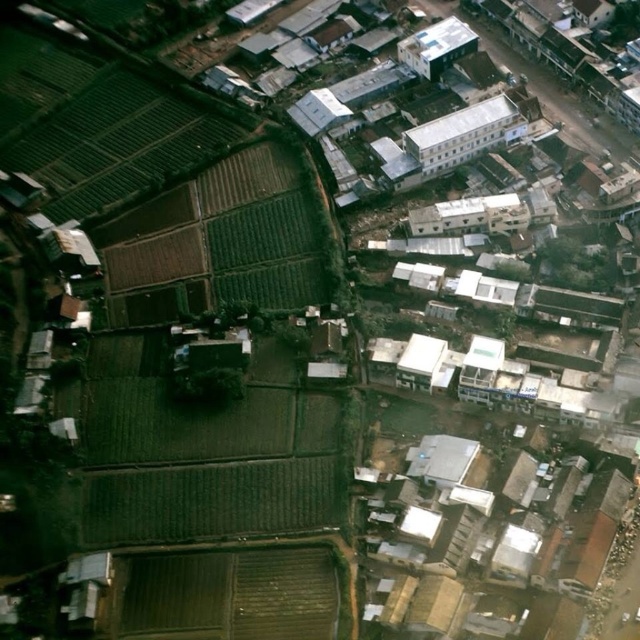
You are a delivery drone flying over an aerial view of a mixed urban and agricultural area. You need to deliver a package to the white smooth building at center. According to the coordinates provided, where exactly should you navigate to drop the package?

The white smooth building at center is located at point (461, 134), so you should navigate to those coordinates to drop the package there.

You are a drone operator flying over the mixed urban and agricultural area shown in the image. You need to determine which of the two points, point (476, 145) or point (468, 42), is closer to the camera. Which point is closer?

Point (476, 145) is closer to the viewer than point (468, 42).